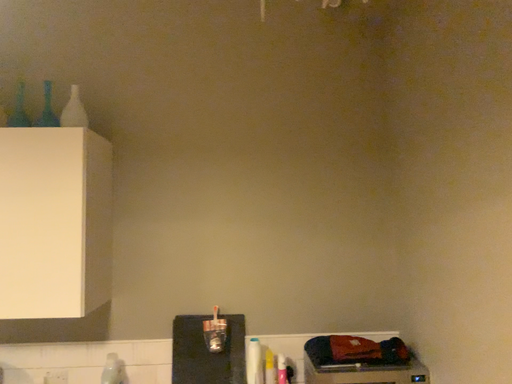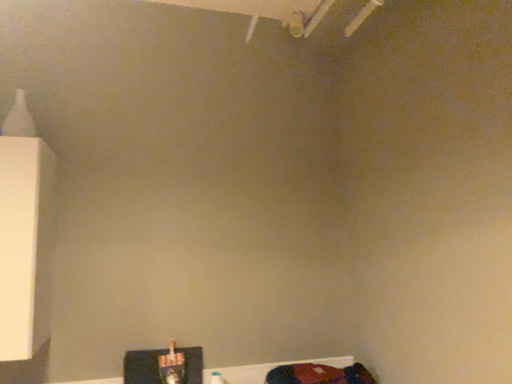
Question: How did the camera likely rotate when shooting the video?

Choices:
 (A) rotated left
 (B) rotated right

Answer: (B)